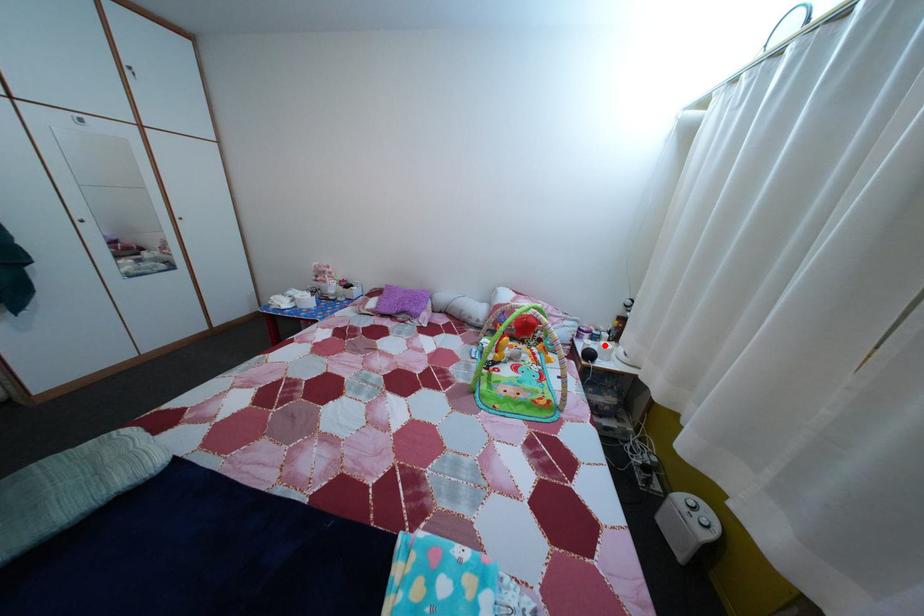
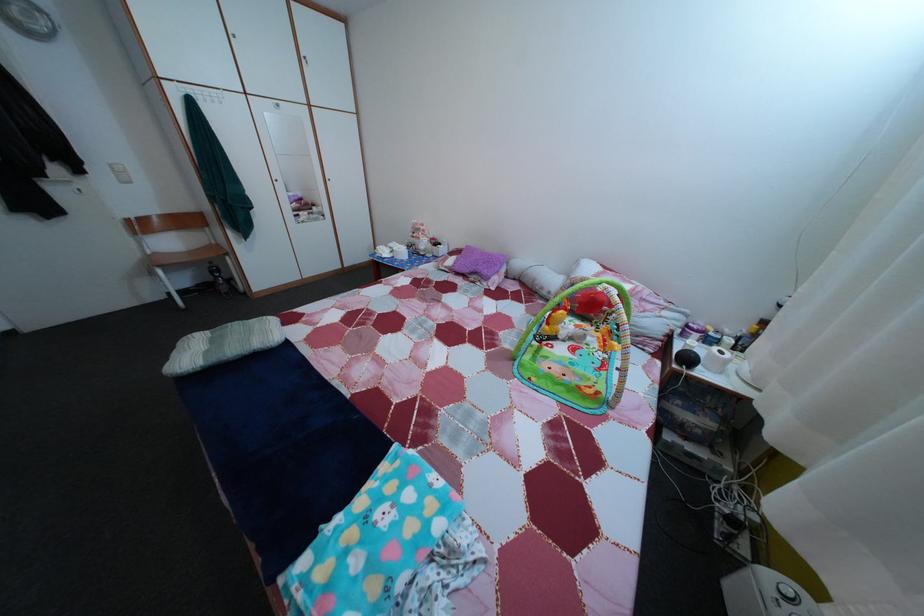
Where in the second image is the point corresponding to the highlighted location from the first image?

(718, 349)